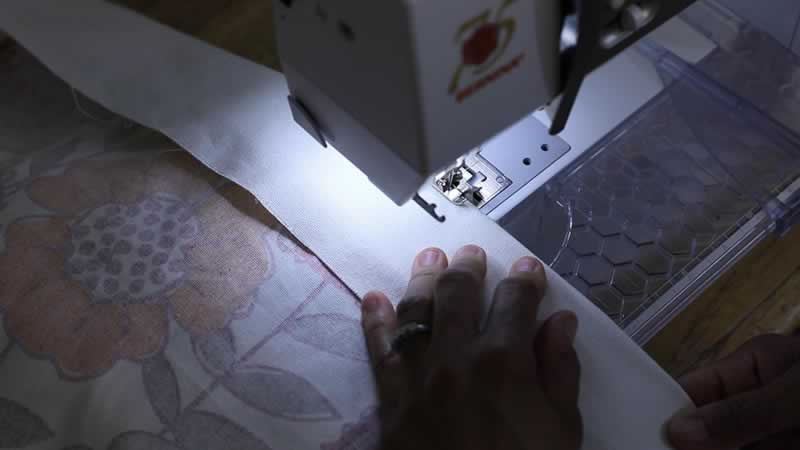
Image resolution: width=800 pixels, height=450 pixels. I want to click on fabric, so click(242, 276).